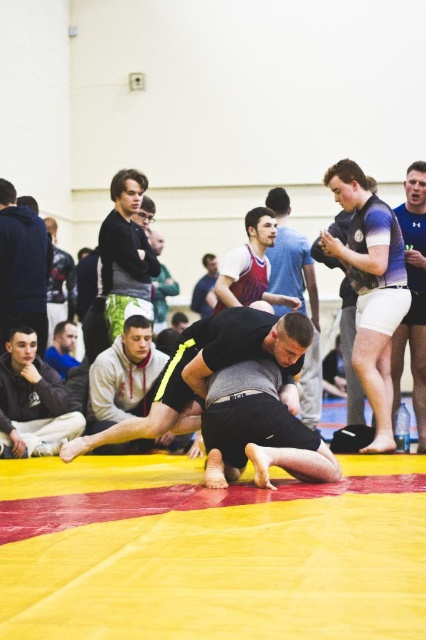
Does white matte shorts at right have a larger size compared to matte blue shirt at upper left?

Indeed, white matte shorts at right has a larger size compared to matte blue shirt at upper left.

Can you confirm if white matte shorts at right is wider than matte blue shirt at upper left?

Incorrect, white matte shorts at right's width does not surpass matte blue shirt at upper left's.

This screenshot has width=426, height=640. What do you see at coordinates (412, 298) in the screenshot? I see `white matte shorts at right` at bounding box center [412, 298].

Where is `white matte shorts at right`? This screenshot has width=426, height=640. white matte shorts at right is located at coordinates (412, 298).

Does black leather jacket at upper left appear under matte red athletic shorts at center?

No, black leather jacket at upper left is not below matte red athletic shorts at center.

Between point (25, 312) and point (229, 294), which one is positioned in front?

Positioned in front is point (229, 294).

Where is `black leather jacket at upper left`? black leather jacket at upper left is located at coordinates (22, 268).

Does point (88, 428) come closer to viewer compared to point (425, 310)?

No, (88, 428) is behind (425, 310).

Based on the photo, between black matte shorts at center and white matte shorts at right, which one is positioned higher?

white matte shorts at right

Measure the distance between black matte shorts at center and camera.

black matte shorts at center and camera are 6.04 meters apart.

The image size is (426, 640). What are the coordinates of `black matte shorts at center` in the screenshot? It's located at (124, 376).